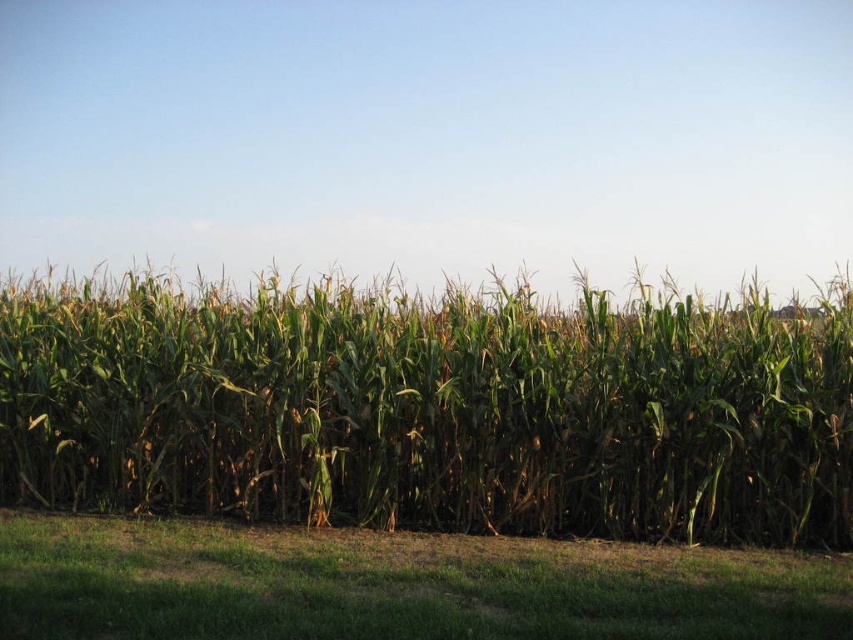
You are standing in the cornfield and see two points marked in the image. Which point is closer to you, point [534,397] or point [607,616]?

Point [607,616] is closer to you because point [534,397] is behind it.

You are a farmer checking the growth of your crops. You notice the green leafy corn at center and the green grass at lower center. Which area takes up more space in the image?

The green grass at lower center occupies more space than the green leafy corn at center.

You are standing at the edge of a cornfield and see the green leafy corn at center and the green grass at lower center. Which one is closer to you?

The green leafy corn at center is closer to you because the green grass at lower center is behind it.